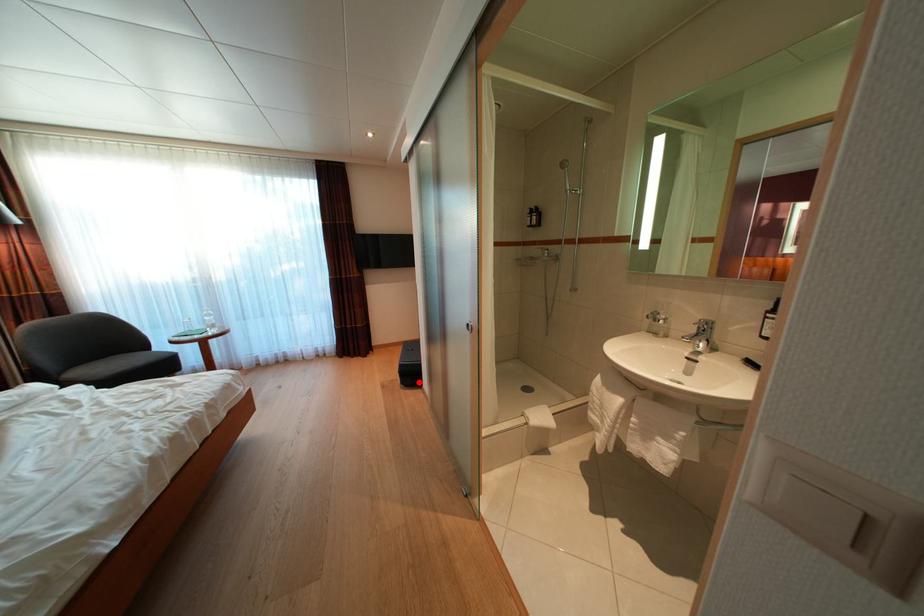
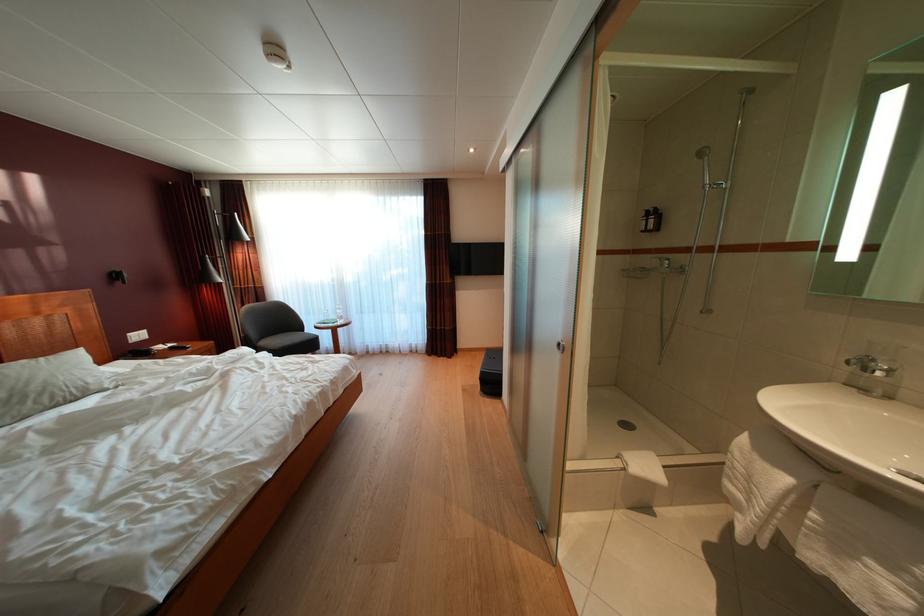
The point at the highlighted location is marked in the first image. Where is the corresponding point in the second image?

(499, 391)